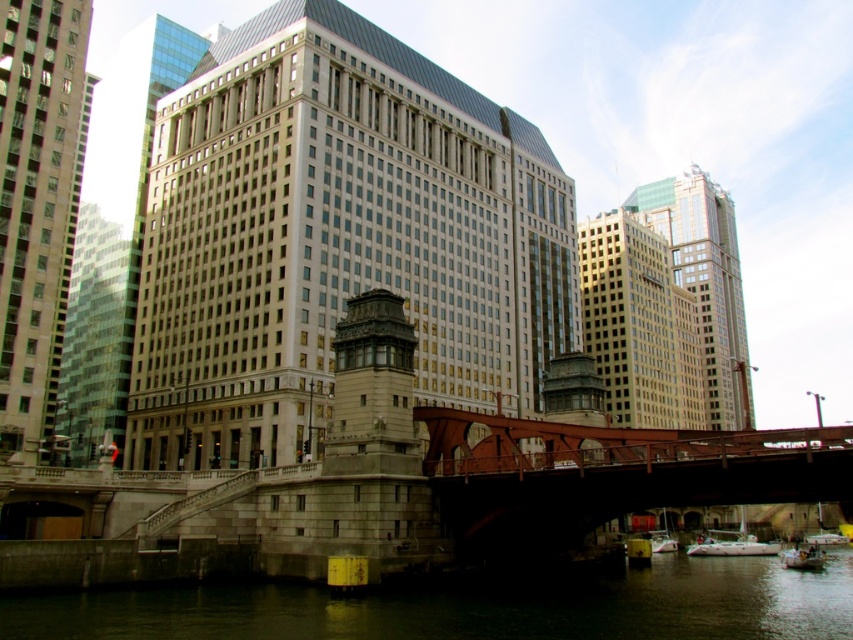
Can you confirm if white plastic boat at lower right is thinner than white plastic boat at lower center?

No, white plastic boat at lower right is not thinner than white plastic boat at lower center.

Can you confirm if white plastic boat at lower right is positioned above white plastic boat at lower center?

Yes, white plastic boat at lower right is above white plastic boat at lower center.

This screenshot has width=853, height=640. I want to click on white plastic boat at lower right, so click(804, 556).

I want to click on white plastic boat at lower right, so [804, 556].

Where is `gold glass building at center-right`? gold glass building at center-right is located at coordinates (639, 324).

Is gold glass building at center-right smaller than white plastic boat at lower right?

Actually, gold glass building at center-right might be larger than white plastic boat at lower right.

Find the location of a particular element. This screenshot has width=853, height=640. gold glass building at center-right is located at coordinates (639, 324).

The height and width of the screenshot is (640, 853). Find the location of `gold glass building at center-right`. gold glass building at center-right is located at coordinates (639, 324).

Who is taller, beige stone tower at center or beige glass skyscraper at center?

With more height is beige stone tower at center.

Consider the image. Does beige stone tower at center appear over beige glass skyscraper at center?

Yes.

Who is more forward, (401, 288) or (16, 314)?

Point (16, 314) is in front.

Where is `beige stone tower at center`? beige stone tower at center is located at coordinates (335, 237).